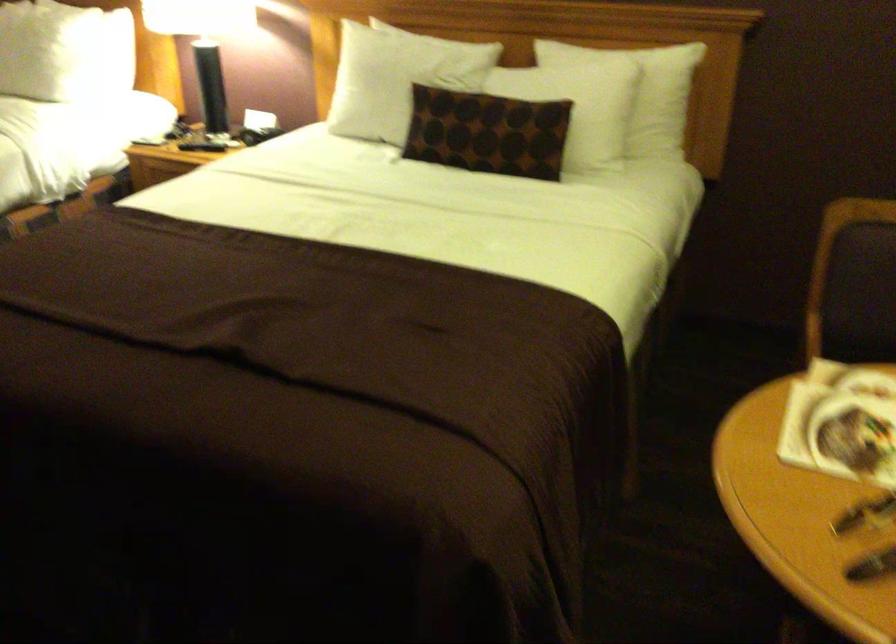
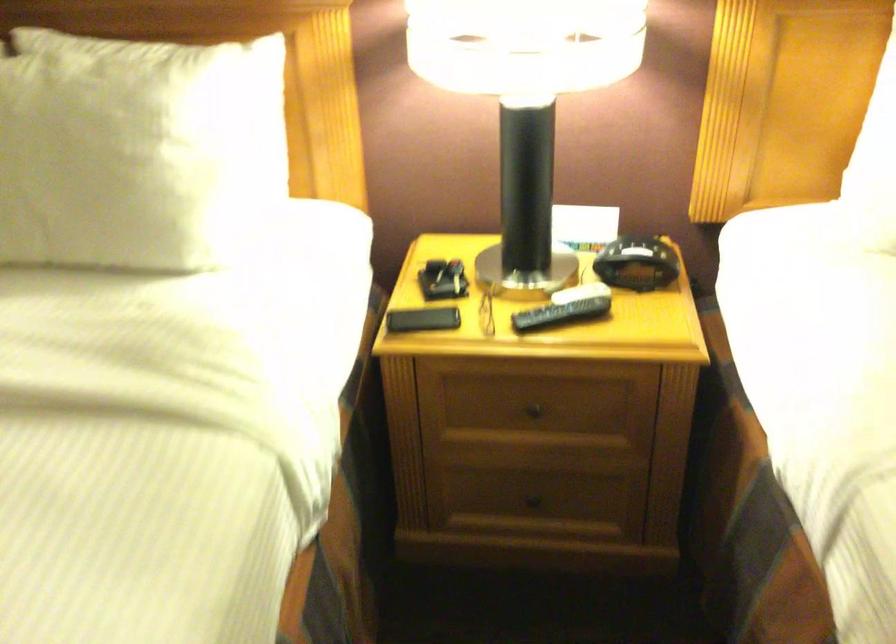
Locate, in the second image, the point that corresponds to point 225,144 in the first image.

(579, 292)